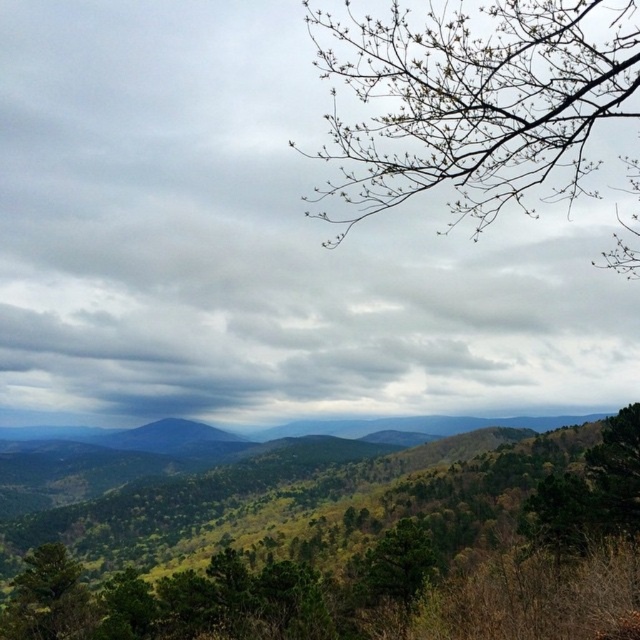
Question: Observing the image, what is the correct spatial positioning of green leafy tree at center in reference to bare branches at upper right?

Choices:
 (A) above
 (B) below

Answer: (B)

Question: Does green leafy tree at center appear over bare branches at upper right?

Choices:
 (A) no
 (B) yes

Answer: (A)

Question: Which point is closer to the camera taking this photo?

Choices:
 (A) (576, 51)
 (B) (205, 499)

Answer: (A)

Question: Does green leafy tree at center appear on the left side of bare branches at upper right?

Choices:
 (A) no
 (B) yes

Answer: (B)

Question: Which object is closer to the camera taking this photo?

Choices:
 (A) bare branches at upper right
 (B) green leafy tree at center

Answer: (A)